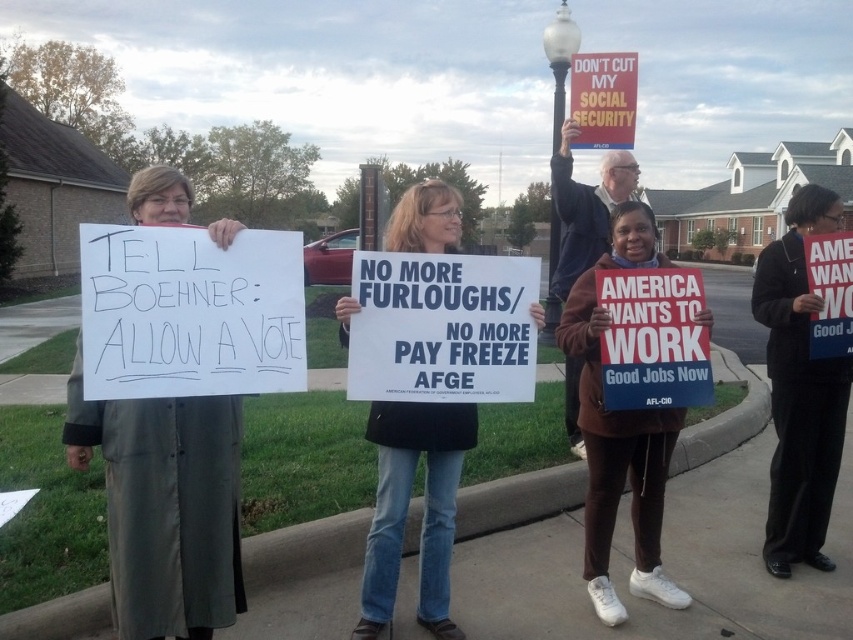
Who is positioned more to the left, blue jeans at center or black fabric jacket at upper right?

blue jeans at center is more to the left.

Is blue jeans at center taller than black fabric jacket at upper right?

Incorrect, blue jeans at center's height is not larger of black fabric jacket at upper right's.

This screenshot has height=640, width=853. Describe the element at coordinates (407, 508) in the screenshot. I see `blue jeans at center` at that location.

The image size is (853, 640). In order to click on blue jeans at center in this screenshot , I will do `click(407, 508)`.

Can you confirm if brown fabric jacket at center is shorter than white glass lamp post at upper center?

Correct, brown fabric jacket at center is not as tall as white glass lamp post at upper center.

Who is more distant from viewer, (570,138) or (560,83)?

Point (560,83)

Where is `brown fabric jacket at center`? This screenshot has height=640, width=853. brown fabric jacket at center is located at coordinates (585, 209).

Locate an element on the screen. This screenshot has width=853, height=640. gray fabric coat at left is located at coordinates (165, 506).

Does gray fabric coat at left have a larger size compared to black fabric jacket at upper right?

No.

Find the location of a particular element. gray fabric coat at left is located at coordinates (165, 506).